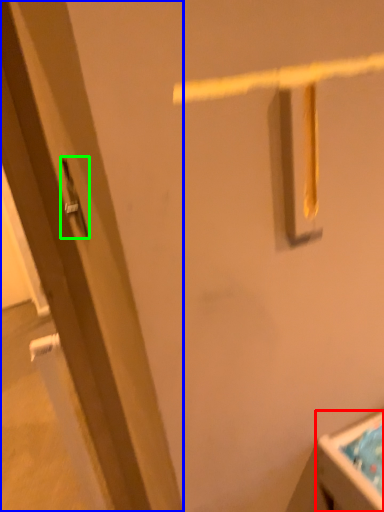
Question: Estimate the real-world distances between objects in this image. Which object is farther from sink (highlighted by a red box), door (highlighted by a blue box) or door handle (highlighted by a green box)?

Choices:
 (A) door
 (B) door handle

Answer: (B)